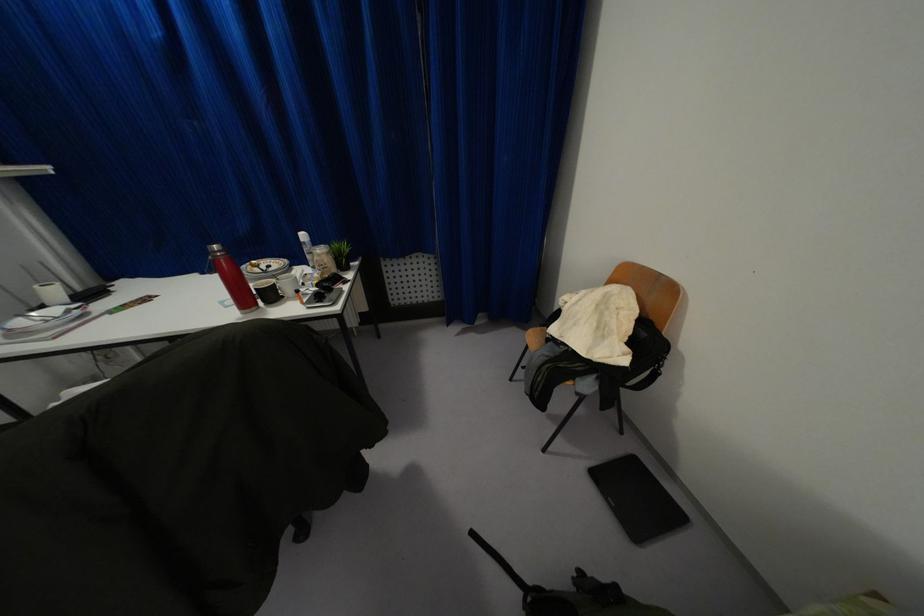
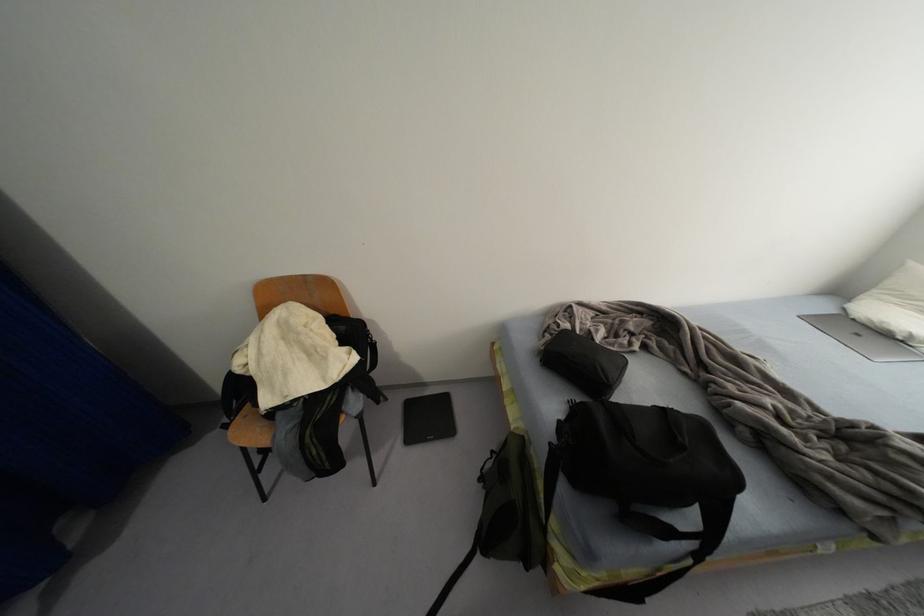
How did the camera likely rotate?

The camera's rotation is toward right-down.